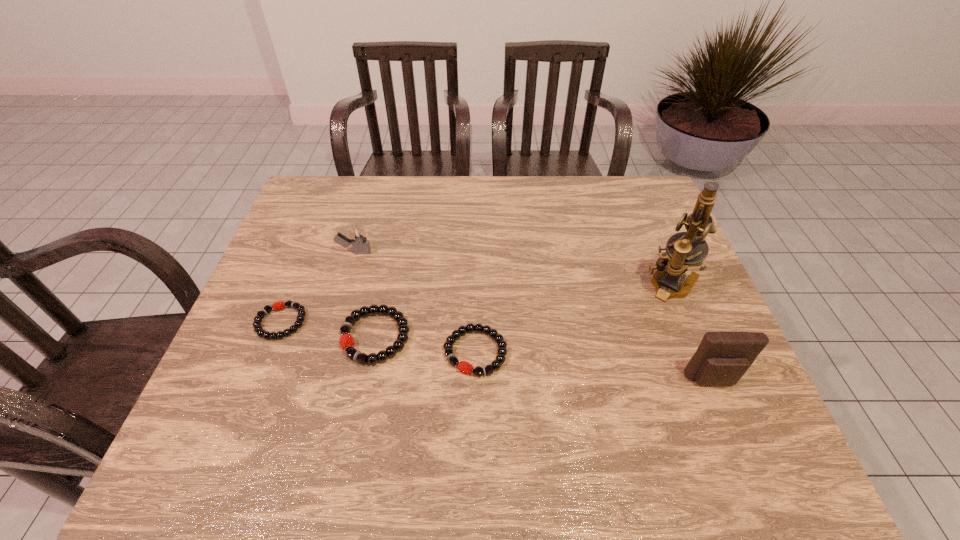
At what (x,y) coordinates should I click in order to perform the action: click on the shortest bracelet. Please return your answer as a coordinate pair (x, y). Looking at the image, I should click on (279, 305).

I want to click on the leftmost bracelet, so click(x=279, y=305).

Locate an element on the screen. Image resolution: width=960 pixels, height=540 pixels. the second bracelet from left to right is located at coordinates (347, 344).

Identify the location of the second shortest object. (465, 367).

This screenshot has width=960, height=540. Find the location of `the third object from right to left`. the third object from right to left is located at coordinates (465, 367).

At what (x,y) coordinates should I click in order to perform the action: click on the tallest object. Please return your answer as a coordinate pair (x, y). Looking at the image, I should click on (687, 249).

This screenshot has width=960, height=540. Find the location of `the second tallest object`. the second tallest object is located at coordinates (722, 358).

Locate an element on the screen. The image size is (960, 540). the farthest object is located at coordinates (358, 238).

Where is `the third tallest object`? Image resolution: width=960 pixels, height=540 pixels. the third tallest object is located at coordinates (358, 238).

At what (x,y) coordinates should I click in order to perform the action: click on free location located on the right of the leftmost bracelet. Please return your answer as a coordinate pair (x, y). Looking at the image, I should click on (419, 322).